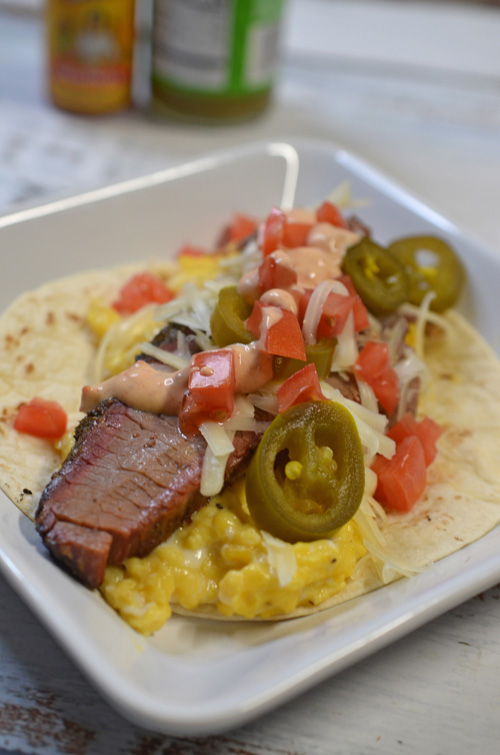
At what (x,y) coordinates should I click in order to perform the action: click on containers. Please return your answer as a coordinate pair (x, y). Looking at the image, I should click on (99, 103), (181, 94).